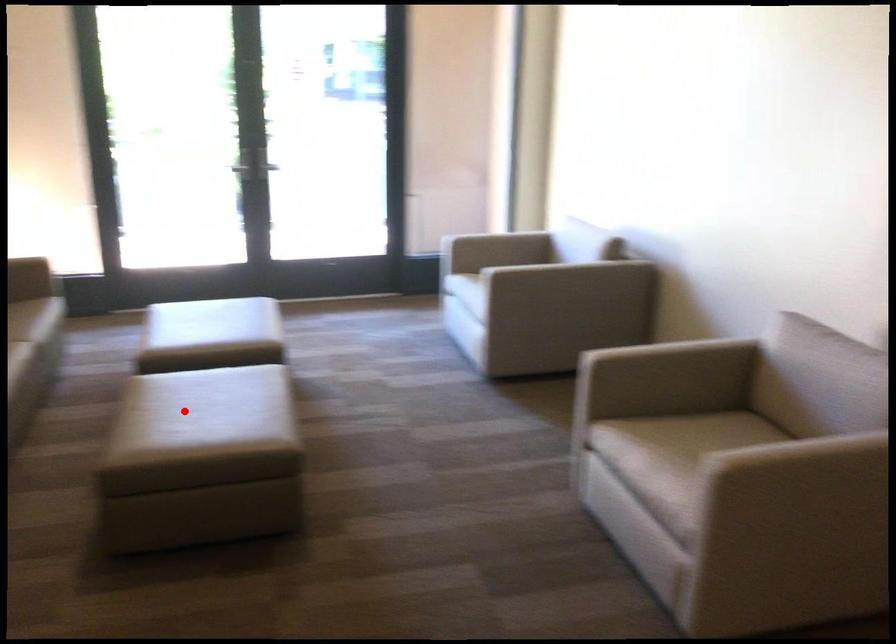
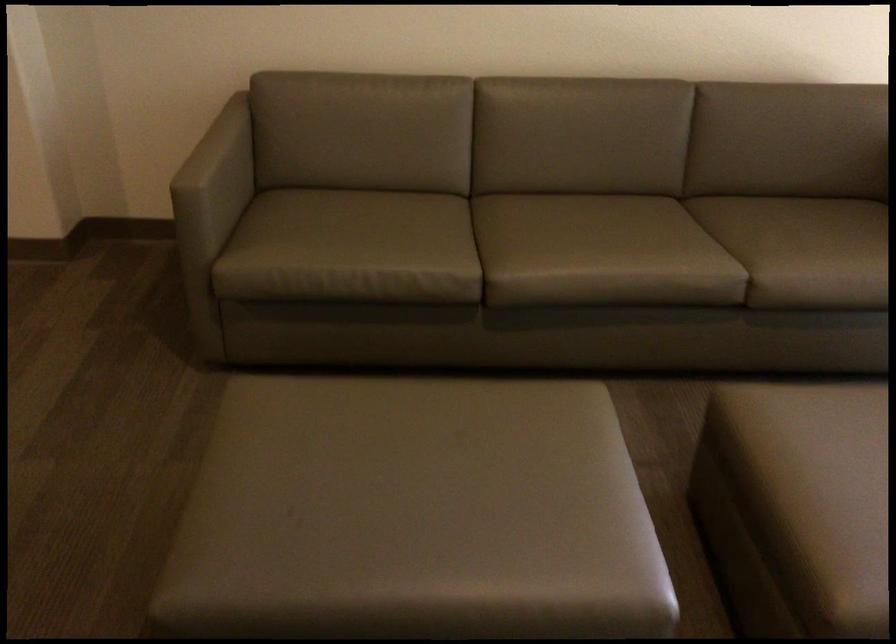
Question: I am providing you with two images of the same scene from different viewpoints. Given a red point in image1, look at the same physical point in image2. Is it:

Choices:
 (A) Closer to the viewpoint
 (B) Farther from the viewpoint

Answer: (A)